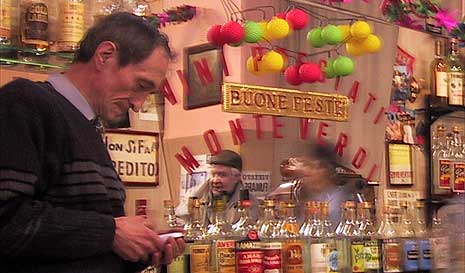
Find the location of a particular element. The image size is (465, 273). wall is located at coordinates (414, 68).